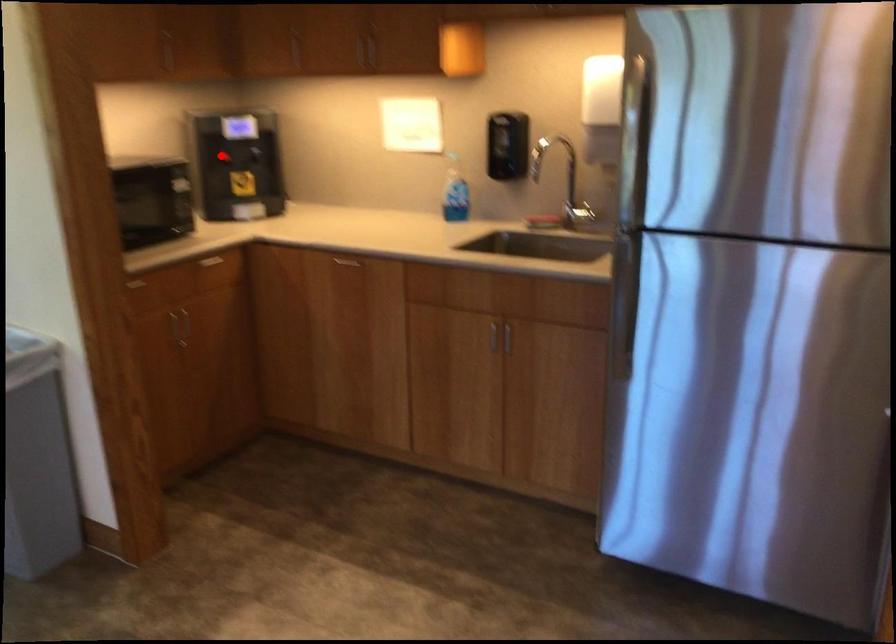
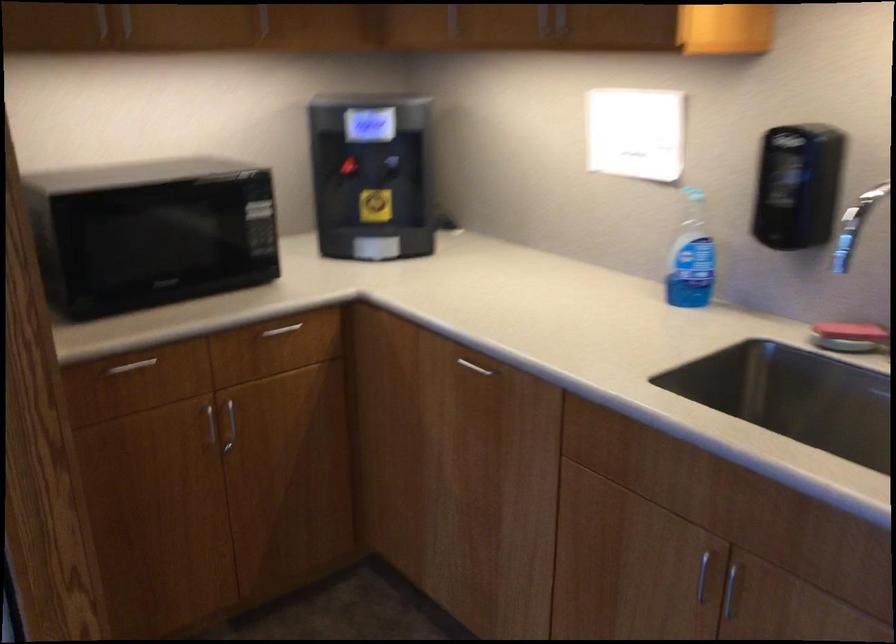
Question: I am providing you with two images of the same scene from different viewpoints. In image1, a red point is highlighted. Considering the same 3D point in image2, which of the following is correct?

Choices:
 (A) It is closer
 (B) It is farther

Answer: (A)